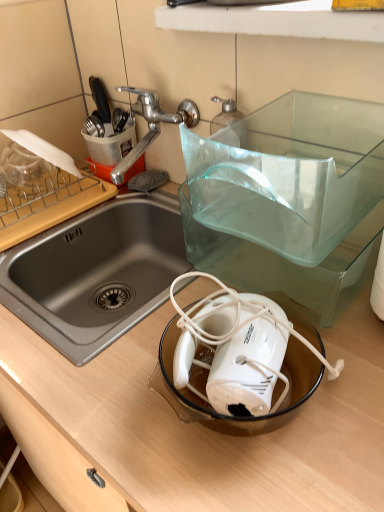
Question: Considering their positions, is silver metallic tap at upper left located in front of or behind wooden counter at center?

Choices:
 (A) behind
 (B) front

Answer: (A)

Question: Is silver metallic tap at upper left wider or thinner than wooden counter at center?

Choices:
 (A) thin
 (B) wide

Answer: (A)

Question: Which object is positioned closest to the white plastic mixer at center?

Choices:
 (A) wooden cutting board at left
 (B) wooden counter at center
 (C) silver metallic tap at upper left

Answer: (B)

Question: Which is nearer to the white plastic mixer at center?

Choices:
 (A) wooden counter at center
 (B) wooden cutting board at left
 (C) silver metallic tap at upper left

Answer: (A)